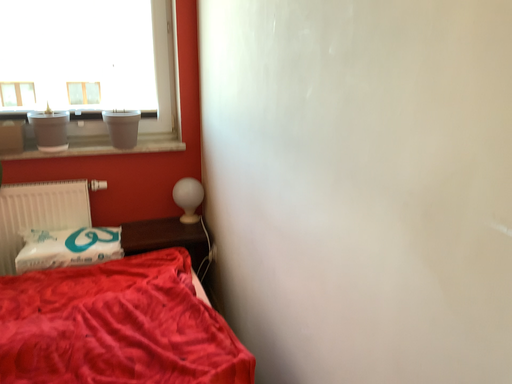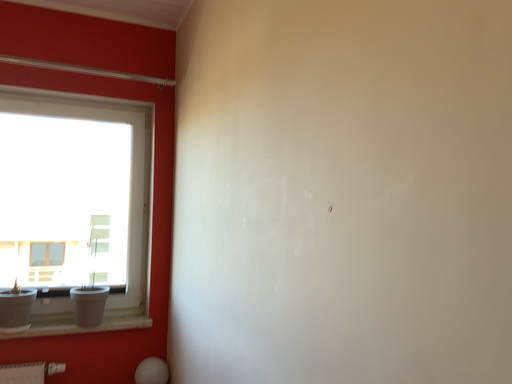
Question: How did the camera likely rotate when shooting the video?

Choices:
 (A) rotated downward
 (B) rotated upward

Answer: (B)